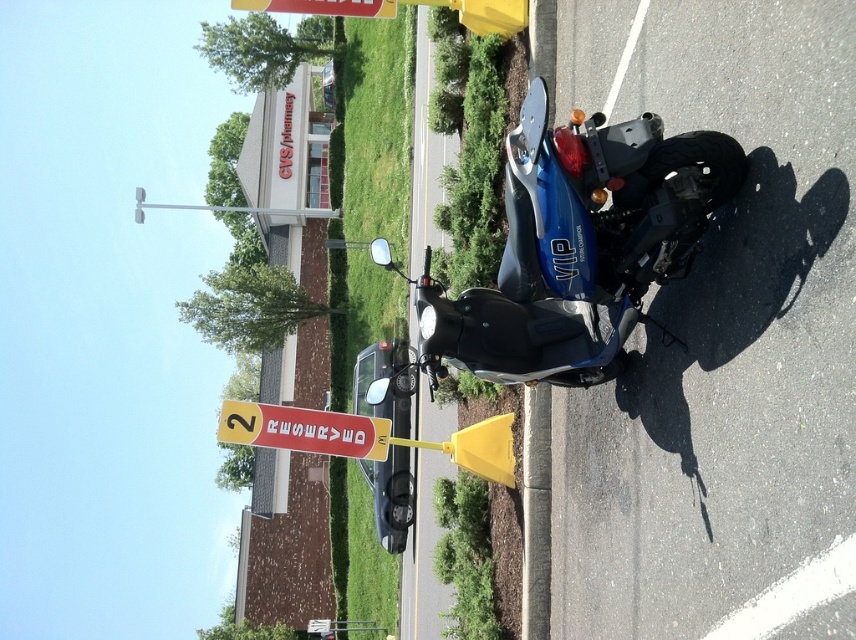
Does blue glossy scooter at center appear under red plastic sign at lower center?

No.

Who is more distant from viewer, (379, 246) or (383, 449)?

Point (383, 449)

Is point (547, 192) in front of point (357, 416)?

Yes, point (547, 192) is in front of point (357, 416).

You are a GUI agent. You are given a task and a screenshot of the screen. Output one action in this format:
    pyautogui.click(x=<x>, y=<y>)
    Task: Click on the blue glossy scooter at center
    The width and height of the screenshot is (856, 640).
    Given the screenshot: What is the action you would take?
    click(x=574, y=248)